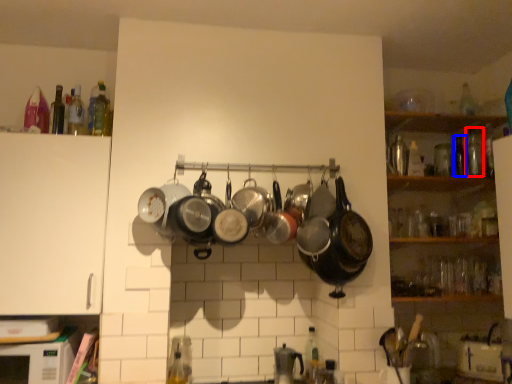
Question: Which object appears closest to the camera in this image, bottle (highlighted by a red box) or bottle (highlighted by a blue box)?

Choices:
 (A) bottle
 (B) bottle

Answer: (B)